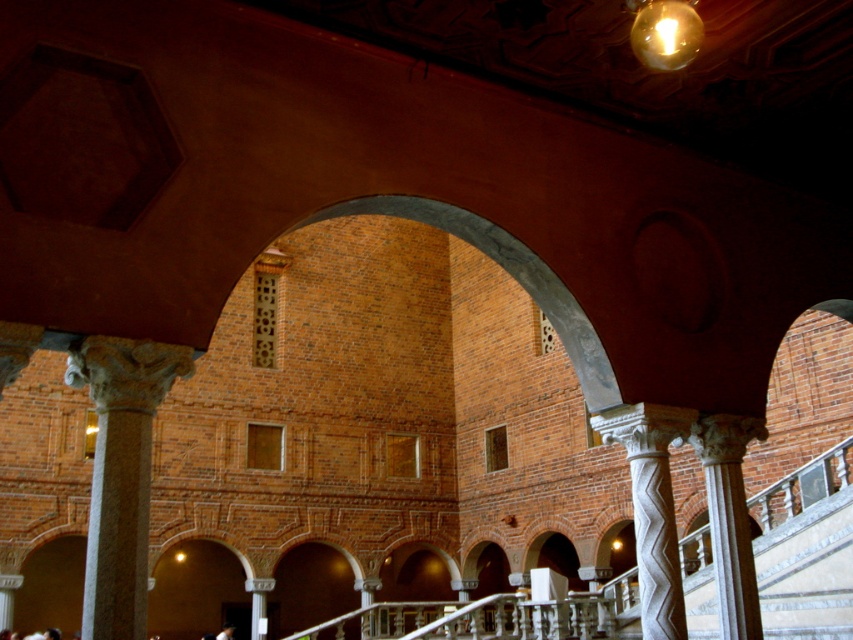
Is white stone column at left thinner than white marble column at center?

No, white stone column at left is not thinner than white marble column at center.

Which is in front, point (108, 472) or point (757, 419)?

Point (108, 472) is in front.

Describe the element at coordinates (120, 474) in the screenshot. The image size is (853, 640). I see `white stone column at left` at that location.

The height and width of the screenshot is (640, 853). Identify the location of white stone column at left. (120, 474).

Can you confirm if white stone column at left is bigger than white carved column at center?

Yes.

Does white stone column at left have a smaller size compared to white carved column at center?

No.

Where is `white stone column at left`? Image resolution: width=853 pixels, height=640 pixels. white stone column at left is located at coordinates (120, 474).

Which is behind, point (640, 538) or point (705, 440)?

Positioned behind is point (705, 440).

Does white carved column at center have a lesser height compared to white marble column at center?

No, white carved column at center is not shorter than white marble column at center.

Does point (669, 484) lie in front of point (747, 432)?

Yes, point (669, 484) is in front of point (747, 432).

You are a GUI agent. You are given a task and a screenshot of the screen. Output one action in this format:
    pyautogui.click(x=<x>, y=<y>)
    Task: Click on the white carved column at center
    Image resolution: width=853 pixels, height=640 pixels.
    Given the screenshot: What is the action you would take?
    pyautogui.click(x=653, y=508)